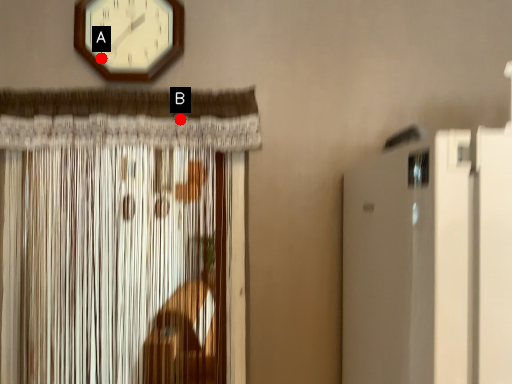
Question: Two points are circled on the image, labeled by A and B beside each circle. Which of the following is the farthest from the observer?

Choices:
 (A) A is further
 (B) B is further

Answer: (B)